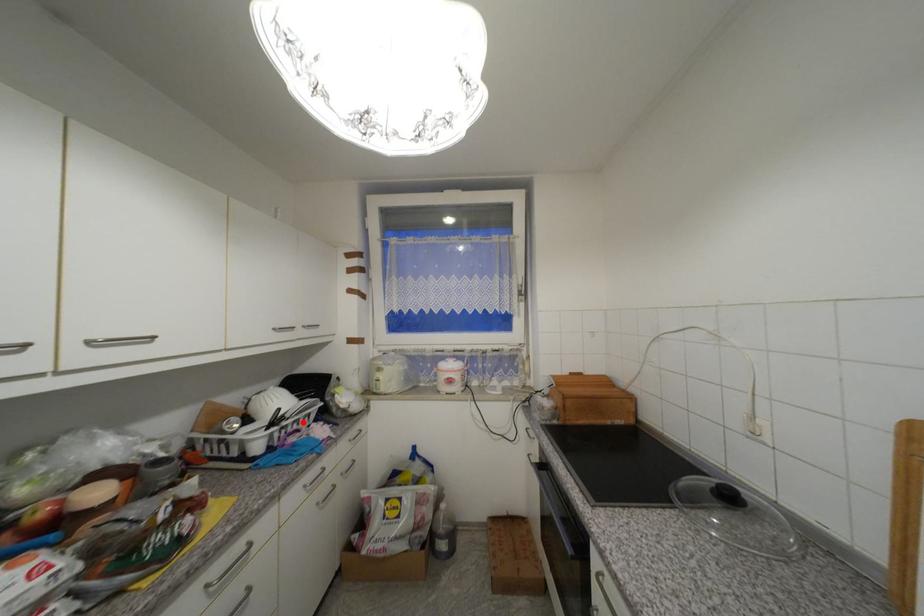
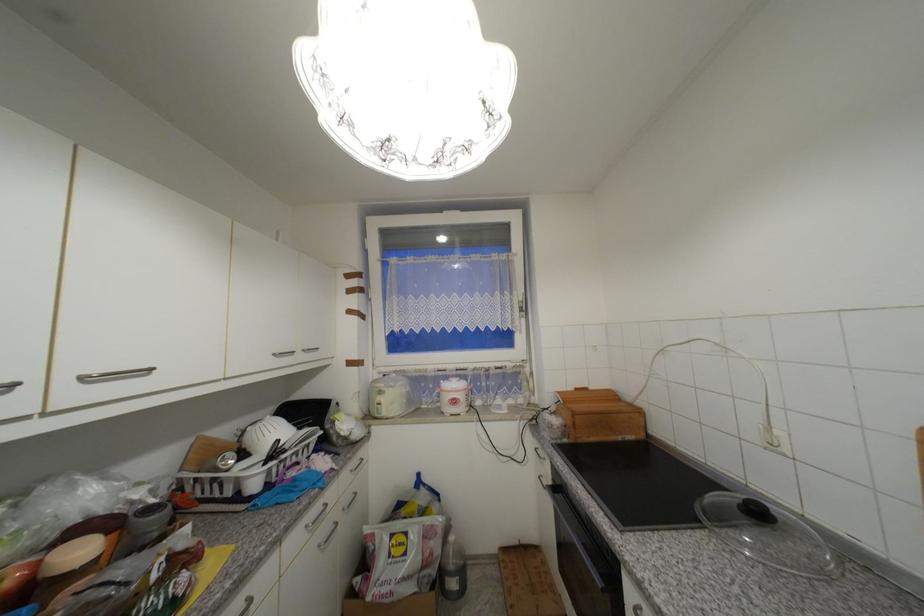
Locate, in the second image, the point that corresponds to the highlighted location in the first image.

(301, 454)